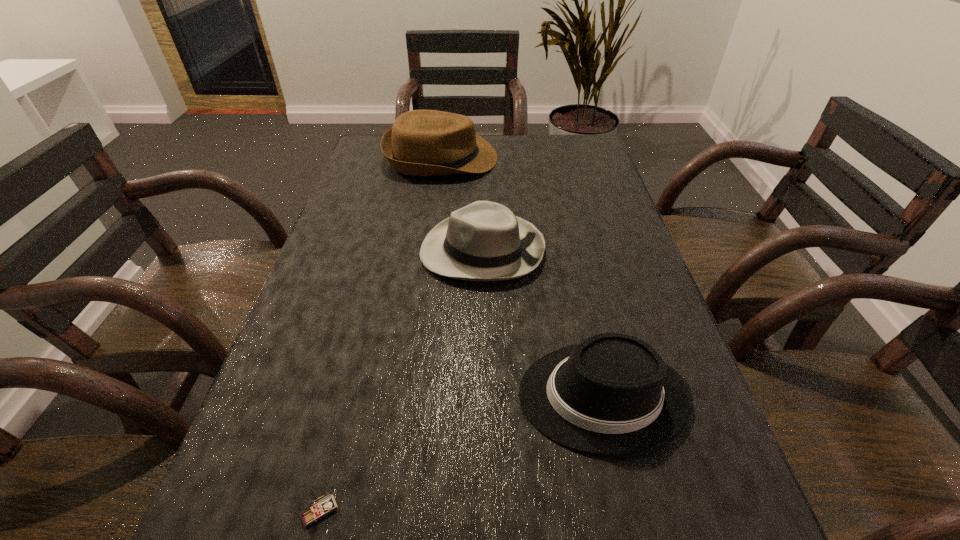
Locate an element on the screen. The image size is (960, 540). free space located 0.070m on the front-facing side of the third farthest object is located at coordinates (477, 396).

Where is `vacant space situated 0.380m on the front-facing side of the third farthest object`? This screenshot has height=540, width=960. vacant space situated 0.380m on the front-facing side of the third farthest object is located at coordinates (292, 396).

Find the location of a particular element. This screenshot has width=960, height=540. vacant space situated 0.140m on the right of the shortest object is located at coordinates (440, 511).

Where is `object that is at the far edge`? This screenshot has width=960, height=540. object that is at the far edge is located at coordinates pyautogui.click(x=421, y=142).

Where is `fedora that is at the left edge`? The height and width of the screenshot is (540, 960). fedora that is at the left edge is located at coordinates (421, 142).

Where is `matchbox that is at the left edge`? The width and height of the screenshot is (960, 540). matchbox that is at the left edge is located at coordinates (325, 506).

Where is `object present at the right edge`? object present at the right edge is located at coordinates (612, 395).

Where is `object that is at the far left corner`? object that is at the far left corner is located at coordinates [x=421, y=142].

Find the location of a particular element. vacant space at the far edge of the desktop is located at coordinates (516, 153).

The height and width of the screenshot is (540, 960). In the image, there is a desktop. Find the location of `vacant space at the left edge`. vacant space at the left edge is located at coordinates (343, 217).